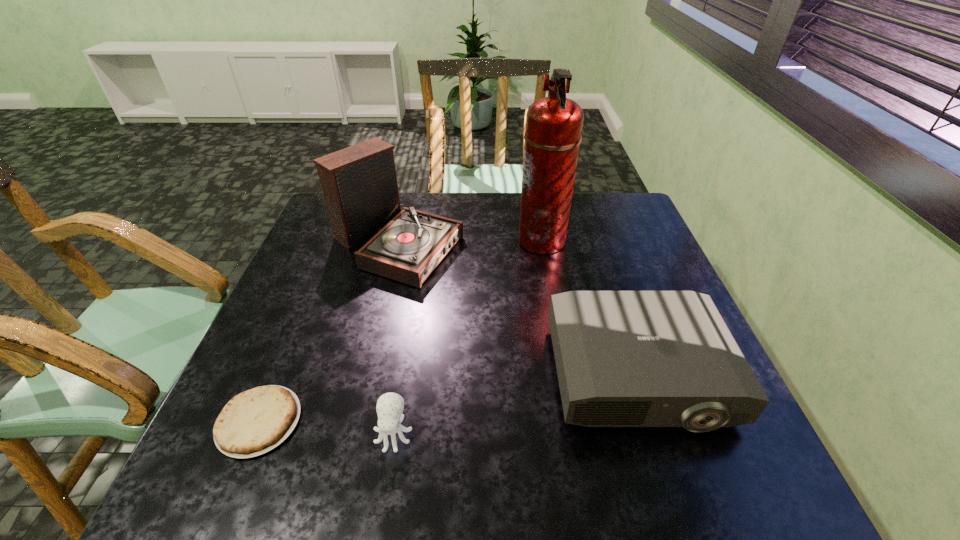
Identify the location of fire extinguisher. (554, 124).

Find the location of a particular element. phonograph record is located at coordinates (359, 183).

The image size is (960, 540). In order to click on projector in this screenshot , I will do `click(624, 358)`.

This screenshot has width=960, height=540. What are the coordinates of `the fourth tallest object` in the screenshot? It's located at (390, 406).

You are a GUI agent. You are given a task and a screenshot of the screen. Output one action in this format:
    pyautogui.click(x=<x>, y=<y>)
    Task: Click on the tortilla
    This screenshot has height=540, width=960.
    Given the screenshot: What is the action you would take?
    pyautogui.click(x=254, y=422)

You are a GUI agent. You are given a task and a screenshot of the screen. Output one action in this format:
    pyautogui.click(x=<x>, y=<y>)
    Task: Click on the vacant region located on the nozzle side of the fire extinguisher
    This screenshot has height=540, width=960.
    Given the screenshot: What is the action you would take?
    pyautogui.click(x=493, y=240)

Find the location of a particular element. free space located 0.210m on the nozzle side of the fire extinguisher is located at coordinates (447, 240).

Locate an element on the screen. This screenshot has height=540, width=960. vacant region located 0.210m on the nozzle side of the fire extinguisher is located at coordinates (447, 240).

The width and height of the screenshot is (960, 540). I want to click on vacant space situated 0.170m on the front of the fourth shortest object, so click(374, 339).

You are a GUI agent. You are given a task and a screenshot of the screen. Output one action in this format:
    pyautogui.click(x=<x>, y=<y>)
    Task: Click on the vacant space located on the front-facing side of the projector
    
    Given the screenshot: What is the action you would take?
    pyautogui.click(x=671, y=478)